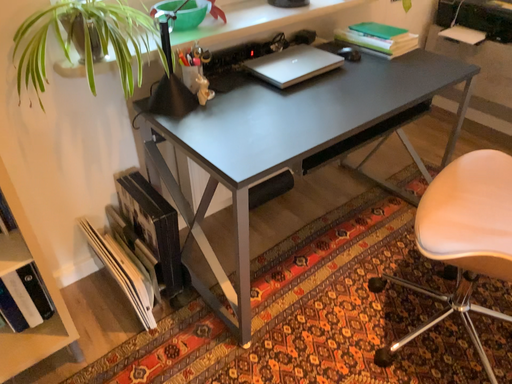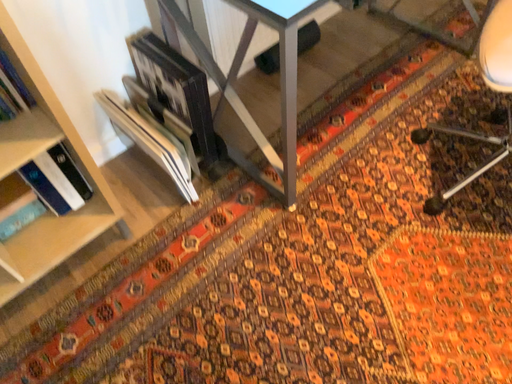
Question: Which way did the camera rotate in the video?

Choices:
 (A) rotated upward
 (B) rotated downward

Answer: (B)